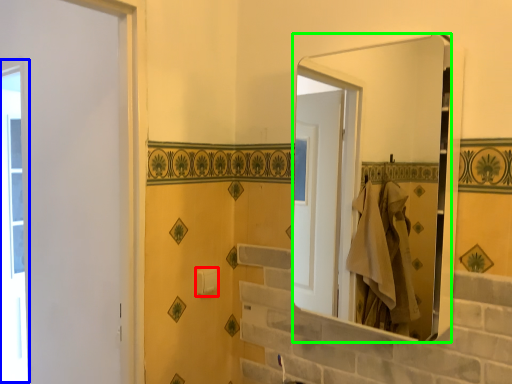
Question: Based on their relative distances, which object is nearer to towel bar (highlighted by a red box)? Choose from window (highlighted by a blue box) and mirror (highlighted by a green box).

Choices:
 (A) window
 (B) mirror

Answer: (B)